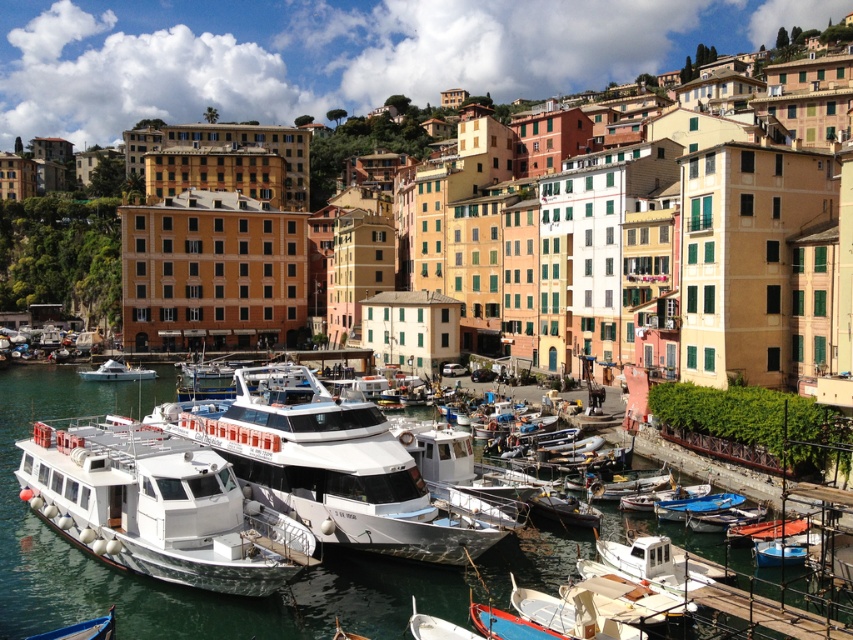
Is white glossy water at center bigger than blue polished wood boat at lower left?

Yes.

Who is taller, white glossy water at center or blue polished wood boat at lower left?

Standing taller between the two is white glossy water at center.

Is point (357, 572) positioned after point (112, 625)?

Yes.

Locate an element on the screen. This screenshot has width=853, height=640. white glossy water at center is located at coordinates (177, 586).

Is white glossy water at center thinner than white glossy boat at center?

In fact, white glossy water at center might be wider than white glossy boat at center.

Is point (320, 611) less distant than point (99, 369)?

Yes, it is.

Where is `white glossy water at center`? white glossy water at center is located at coordinates (177, 586).

Is white glossy yacht at center above white glossy boat at center?

No, white glossy yacht at center is not above white glossy boat at center.

Does white glossy yacht at center have a lesser height compared to white glossy boat at center?

No, white glossy yacht at center is not shorter than white glossy boat at center.

The height and width of the screenshot is (640, 853). I want to click on white glossy yacht at center, so click(x=325, y=465).

You are a GUI agent. You are given a task and a screenshot of the screen. Output one action in this format:
    pyautogui.click(x=<x>, y=<y>)
    Task: Click on the white glossy yacht at center
    
    Given the screenshot: What is the action you would take?
    pyautogui.click(x=325, y=465)